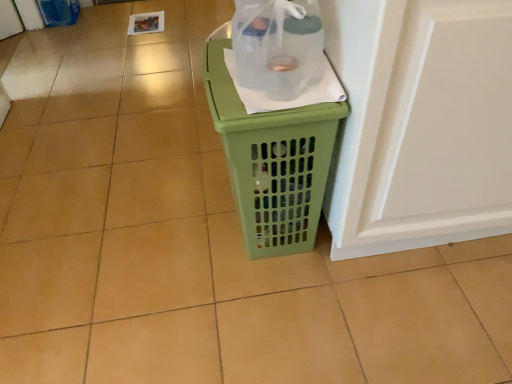
Question: Can you confirm if green plastic laundry basket at center is bigger than transparent plastic bottle at center?

Choices:
 (A) yes
 (B) no

Answer: (A)

Question: Considering the relative positions of green plastic laundry basket at center and transparent plastic bottle at center in the image provided, is green plastic laundry basket at center behind transparent plastic bottle at center?

Choices:
 (A) yes
 (B) no

Answer: (A)

Question: Is green plastic laundry basket at center oriented away from transparent plastic bottle at center?

Choices:
 (A) no
 (B) yes

Answer: (A)

Question: Is green plastic laundry basket at center surrounding transparent plastic bottle at center?

Choices:
 (A) yes
 (B) no

Answer: (B)

Question: From a real-world perspective, is green plastic laundry basket at center on top of transparent plastic bottle at center?

Choices:
 (A) yes
 (B) no

Answer: (B)

Question: Considering the positions of green plastic laundry basket at center and white glossy screen door at right in the image, is green plastic laundry basket at center taller or shorter than white glossy screen door at right?

Choices:
 (A) tall
 (B) short

Answer: (B)

Question: Is green plastic laundry basket at center wider or thinner than white glossy screen door at right?

Choices:
 (A) thin
 (B) wide

Answer: (A)

Question: Is green plastic laundry basket at center situated inside white glossy screen door at right or outside?

Choices:
 (A) inside
 (B) outside

Answer: (B)

Question: From the image's perspective, is green plastic laundry basket at center positioned above or below white glossy screen door at right?

Choices:
 (A) below
 (B) above

Answer: (A)

Question: Is transparent plastic bottle at center to the left or to the right of white glossy screen door at right in the image?

Choices:
 (A) right
 (B) left

Answer: (B)

Question: From their relative heights in the image, would you say transparent plastic bottle at center is taller or shorter than white glossy screen door at right?

Choices:
 (A) tall
 (B) short

Answer: (B)

Question: Choose the correct answer: Is transparent plastic bottle at center inside white glossy screen door at right or outside it?

Choices:
 (A) inside
 (B) outside

Answer: (B)

Question: Looking at their shapes, would you say transparent plastic bottle at center is wider or thinner than white glossy screen door at right?

Choices:
 (A) thin
 (B) wide

Answer: (A)

Question: In the image, is white glossy screen door at right on the left side or the right side of transparent plastic bottle at center?

Choices:
 (A) left
 (B) right

Answer: (B)

Question: Is white glossy screen door at right inside the boundaries of transparent plastic bottle at center, or outside?

Choices:
 (A) outside
 (B) inside

Answer: (A)